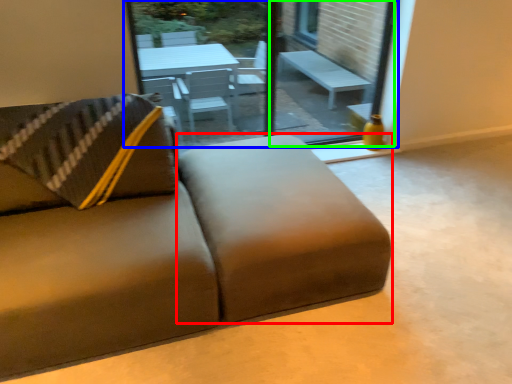
Question: Based on their relative distances, which object is farther from footrest (highlighted by a red box)? Choose from window (highlighted by a blue box) and window screen (highlighted by a green box).

Choices:
 (A) window
 (B) window screen

Answer: (B)